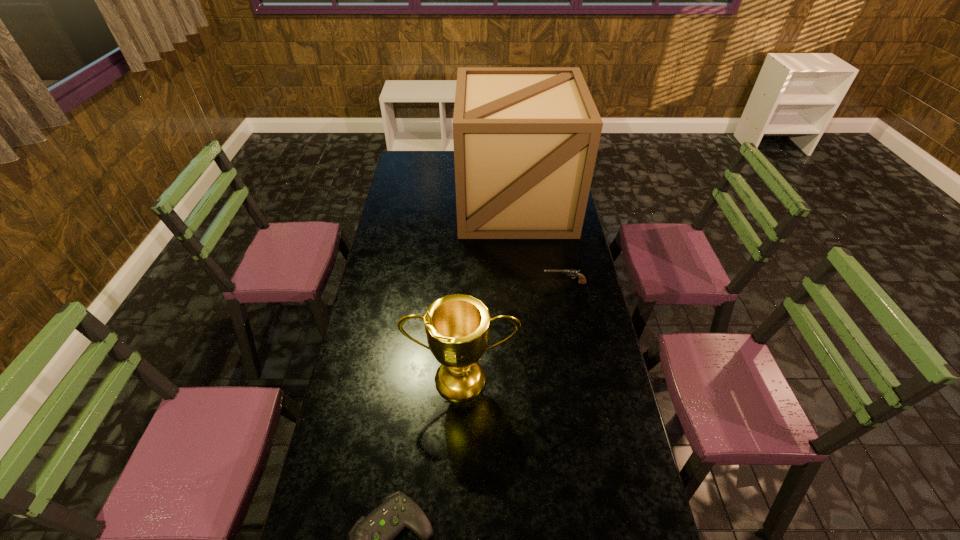
Where is `the farthest object`? The height and width of the screenshot is (540, 960). the farthest object is located at coordinates (526, 139).

You are a GUI agent. You are given a task and a screenshot of the screen. Output one action in this format:
    pyautogui.click(x=<x>, y=<y>)
    Task: Click on the box
    The width and height of the screenshot is (960, 540).
    Given the screenshot: What is the action you would take?
    pyautogui.click(x=526, y=139)

Locate an element on the screen. Image resolution: width=960 pixels, height=540 pixels. award is located at coordinates (457, 326).

Identify the location of the second nearest object. This screenshot has height=540, width=960. pos(457,326).

This screenshot has width=960, height=540. I want to click on the third tallest object, so click(x=582, y=280).

What are the coordinates of `the second farthest object` in the screenshot? It's located at (582, 280).

I want to click on free region located 0.240m on the reinforced sides of the tallest object, so click(x=522, y=276).

Where is `free space located on the shiny surface of the second nearest object`? Image resolution: width=960 pixels, height=540 pixels. free space located on the shiny surface of the second nearest object is located at coordinates (459, 478).

Find the location of a particular element. Image resolution: width=960 pixels, height=540 pixels. vacant space located aiming along the barrel of the second farthest object is located at coordinates [x=528, y=283].

At what (x,y) coordinates should I click in order to perform the action: click on vacant space situated 0.380m aiming along the barrel of the second farthest object. Please return your answer as a coordinate pair (x, y). Looking at the image, I should click on (449, 283).